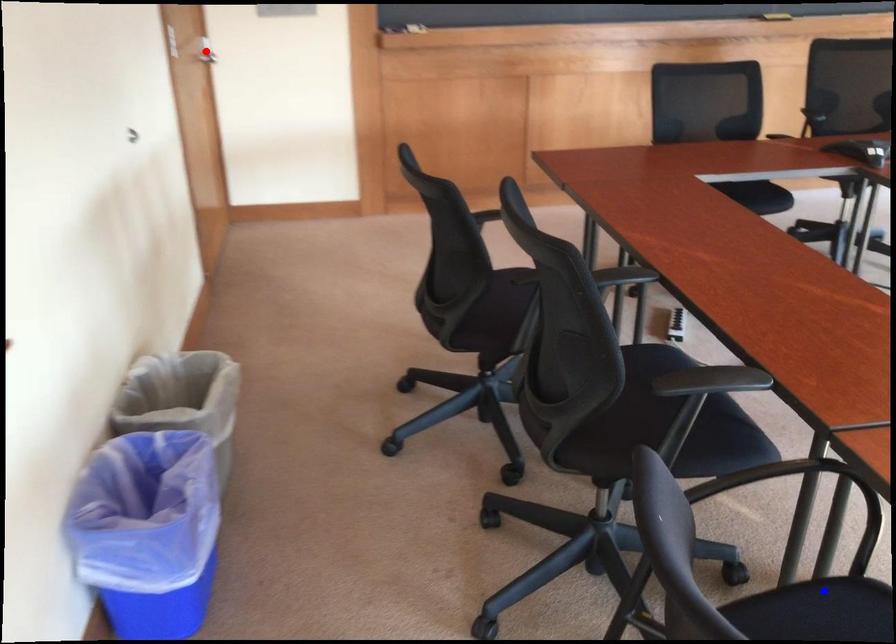
Question: In the image, two points are highlighted. Which point is nearer to the camera? Reply with the corresponding letter.

Choices:
 (A) blue point
 (B) red point

Answer: (A)